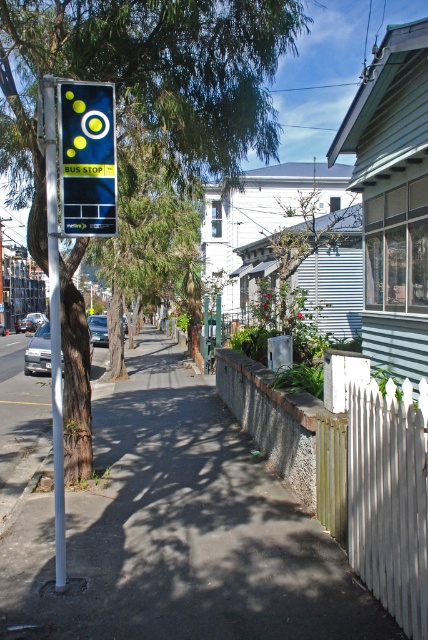
You are a pedestrian standing on the sidewalk looking at the bus stop. Which object at the upper left has a smaller width between the green leafy tree at upper left and the matte black sign at upper left?

The green leafy tree at upper left is thinner than the matte black sign at upper left, so the green leafy tree at upper left has a smaller width.